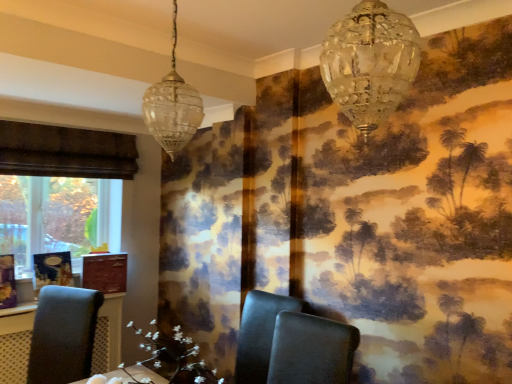
Question: Is crystal glass chandelier at upper center, positioned as the 2th lamp in back-to-front order, thinner than black leather chair at center, the 2th chair viewed from the right?

Choices:
 (A) no
 (B) yes

Answer: (B)

Question: Does crystal glass chandelier at upper center, which is counted as the first lamp, starting from the right, have a greater height compared to black leather chair at center, placed as the 2th chair when sorted from left to right?

Choices:
 (A) yes
 (B) no

Answer: (B)

Question: Does crystal glass chandelier at upper center, which is the second lamp from left to right, appear on the right side of black leather chair at center, the 2th chair viewed from the right?

Choices:
 (A) yes
 (B) no

Answer: (A)

Question: From the image's perspective, is crystal glass chandelier at upper center, positioned as the 2th lamp in back-to-front order, over black leather chair at center, placed as the 2th chair when sorted from left to right?

Choices:
 (A) no
 (B) yes

Answer: (B)

Question: Can you confirm if crystal glass chandelier at upper center, placed as the 1th lamp when sorted from front to back, is wider than black leather chair at center, placed as the 2th chair when sorted from left to right?

Choices:
 (A) yes
 (B) no

Answer: (B)

Question: From a real-world perspective, is matte dark gray chair at center, the first chair from the right, positioned above or below white floral arrangement at center?

Choices:
 (A) above
 (B) below

Answer: (B)

Question: Is matte dark gray chair at center, the first chair from the right, bigger or smaller than white floral arrangement at center?

Choices:
 (A) small
 (B) big

Answer: (B)

Question: Is matte dark gray chair at center, placed as the 3th chair when sorted from left to right, inside or outside of white floral arrangement at center?

Choices:
 (A) inside
 (B) outside

Answer: (B)

Question: Looking at their shapes, would you say matte dark gray chair at center, the first chair from the right, is wider or thinner than white floral arrangement at center?

Choices:
 (A) thin
 (B) wide

Answer: (B)

Question: From the image's perspective, is crystal glass chandelier at upper center, placed as the 1th lamp when sorted from front to back, above or below black leather chair at center, the 2th chair viewed from the right?

Choices:
 (A) below
 (B) above

Answer: (B)

Question: Do you think crystal glass chandelier at upper center, which is counted as the first lamp, starting from the right, is within black leather chair at center, placed as the 2th chair when sorted from left to right, or outside of it?

Choices:
 (A) outside
 (B) inside

Answer: (A)

Question: Is point (346, 36) positioned closer to the camera than point (253, 365)?

Choices:
 (A) closer
 (B) farther

Answer: (A)

Question: In terms of height, does crystal glass chandelier at upper center, positioned as the 2th lamp in back-to-front order, look taller or shorter compared to black leather chair at center, the 2th chair viewed from the right?

Choices:
 (A) short
 (B) tall

Answer: (A)

Question: From a real-world perspective, relative to black leather chair at center, the 2th chair viewed from the right, is clear glass pendant light at upper left, the first lamp in the left-to-right sequence, vertically above or below?

Choices:
 (A) above
 (B) below

Answer: (A)

Question: In the image, is clear glass pendant light at upper left, the first lamp in the left-to-right sequence, on the left side or the right side of black leather chair at center, the 2th chair viewed from the right?

Choices:
 (A) left
 (B) right

Answer: (A)